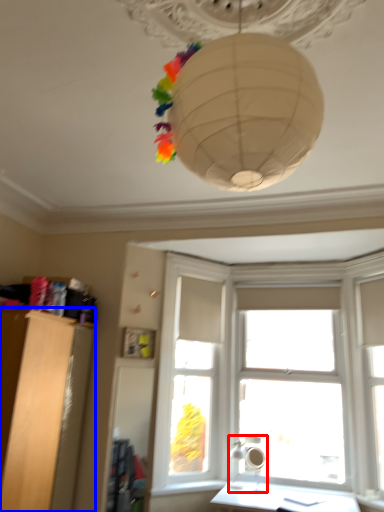
Question: Which of the following is the farthest to the observer, lamp (highlighted by a red box) or furniture (highlighted by a blue box)?

Choices:
 (A) lamp
 (B) furniture

Answer: (A)